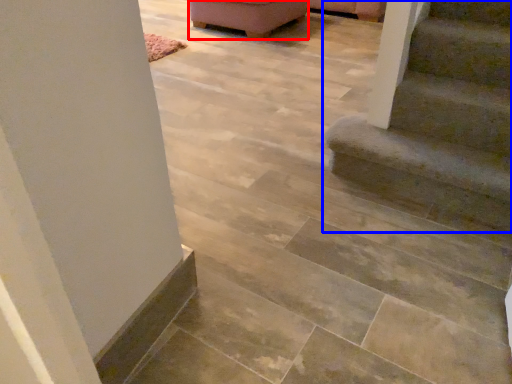
Question: Which object appears closest to the camera in this image, furniture (highlighted by a red box) or stairs (highlighted by a blue box)?

Choices:
 (A) furniture
 (B) stairs

Answer: (B)